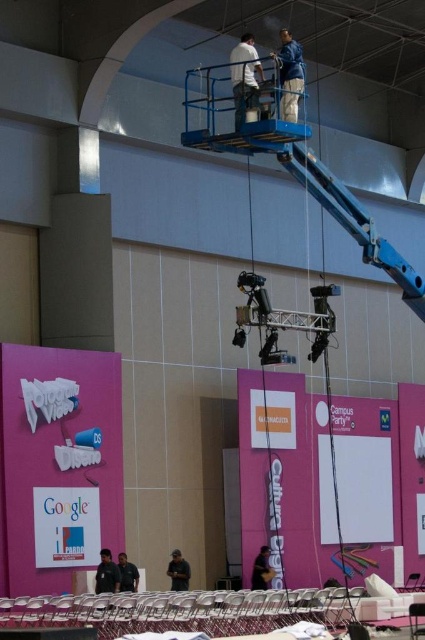
Question: Which object is farther from the camera taking this photo?

Choices:
 (A) dark gray fabric jacket at lower center
 (B) black fabric person at lower left

Answer: (A)

Question: Which point is closer to the camera taking this photo?

Choices:
 (A) (124, 556)
 (B) (167, 566)
 (C) (260, 580)

Answer: (A)

Question: Does dark brown leather jacket at lower center appear on the right side of dark gray shirt at lower center?

Choices:
 (A) yes
 (B) no

Answer: (A)

Question: Is black fabric person at lower left positioned before dark gray shirt at lower center?

Choices:
 (A) no
 (B) yes

Answer: (B)

Question: Which point is farther to the camera?

Choices:
 (A) (173, 582)
 (B) (263, 557)
 (C) (136, 572)
 (D) (105, 570)

Answer: (B)

Question: Does black fabric person at lower left have a smaller size compared to dark gray fabric jacket at lower center?

Choices:
 (A) yes
 (B) no

Answer: (B)